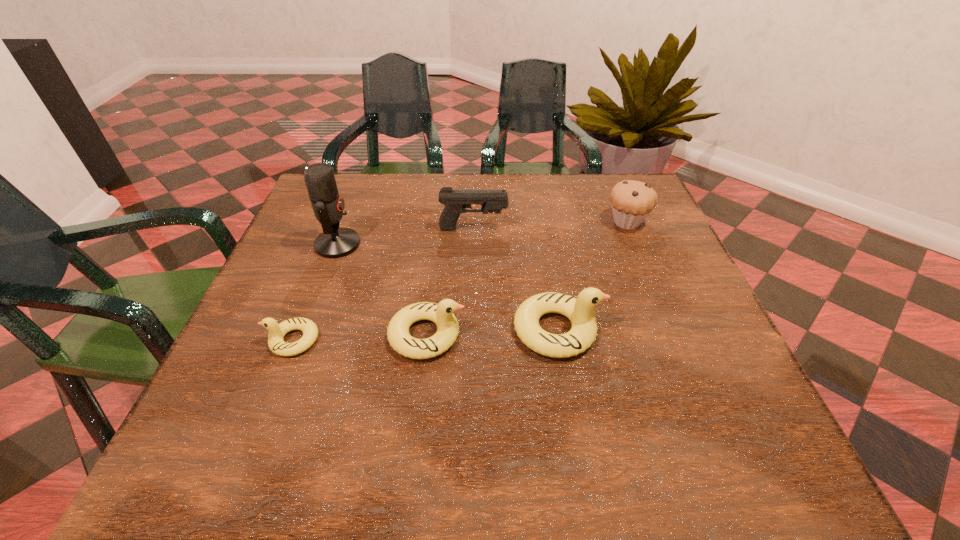
Please show where to add a duckling on the right while keeping spacing even. Please provide its 2D coordinates. Your answer should be formatted as a tuple, i.e. [(x, y)], where the tuple contains the x and y coordinates of a point satisfying the conditions above.

[(685, 325)]